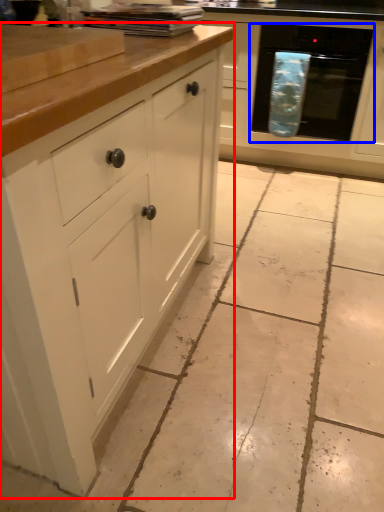
Question: Which point is closer to the camera, cabinetry (highlighted by a red box) or oven (highlighted by a blue box)?

Choices:
 (A) cabinetry
 (B) oven

Answer: (A)